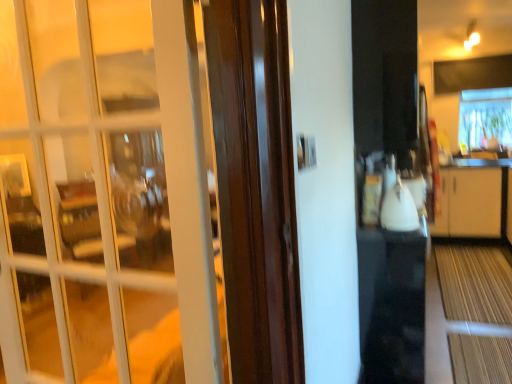
Question: Is transparent plastic window at upper right further to camera compared to white glass door at left?

Choices:
 (A) yes
 (B) no

Answer: (A)

Question: Is transparent plastic window at upper right far away from white glass door at left?

Choices:
 (A) no
 (B) yes

Answer: (B)

Question: Does transparent plastic window at upper right have a larger size compared to white glass door at left?

Choices:
 (A) no
 (B) yes

Answer: (B)

Question: Is transparent plastic window at upper right at the left side of white glass door at left?

Choices:
 (A) yes
 (B) no

Answer: (B)

Question: Is transparent plastic window at upper right oriented away from white glass door at left?

Choices:
 (A) no
 (B) yes

Answer: (A)

Question: Does transparent plastic window at upper right have a greater width compared to white glass door at left?

Choices:
 (A) yes
 (B) no

Answer: (A)

Question: Considering the relative sizes of white glossy kettle at center and transparent plastic window at upper right in the image provided, is white glossy kettle at center thinner than transparent plastic window at upper right?

Choices:
 (A) yes
 (B) no

Answer: (A)

Question: Is white glossy kettle at center turned away from transparent plastic window at upper right?

Choices:
 (A) yes
 (B) no

Answer: (B)

Question: Can you confirm if white glossy kettle at center is positioned to the left of transparent plastic window at upper right?

Choices:
 (A) no
 (B) yes

Answer: (B)

Question: Is white glossy kettle at center further to camera compared to transparent plastic window at upper right?

Choices:
 (A) no
 (B) yes

Answer: (A)

Question: From a real-world perspective, is white glossy kettle at center physically above transparent plastic window at upper right?

Choices:
 (A) no
 (B) yes

Answer: (A)

Question: Does white glossy kettle at center have a greater height compared to transparent plastic window at upper right?

Choices:
 (A) no
 (B) yes

Answer: (A)

Question: From a real-world perspective, does white glass door at left stand above white glossy kettle at center?

Choices:
 (A) yes
 (B) no

Answer: (A)